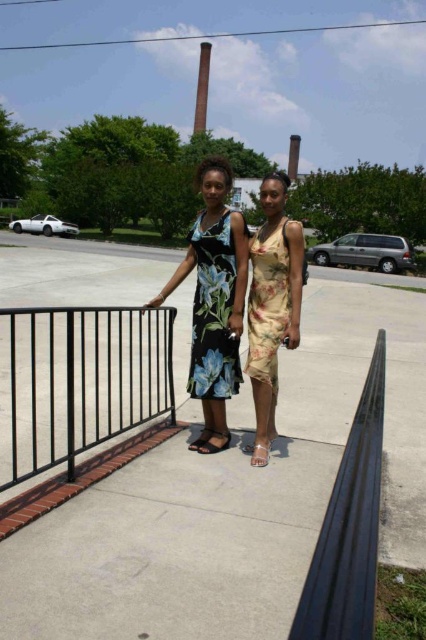
Question: Can you confirm if concrete sidewalk at center is positioned to the left of yellow floral dress at center?

Choices:
 (A) no
 (B) yes

Answer: (B)

Question: Estimate the real-world distances between objects in this image. Which object is closer to the yellow floral dress at center?

Choices:
 (A) matte beige sandal at lower center
 (B) concrete sidewalk at center

Answer: (A)

Question: Which point is closer to the camera?

Choices:
 (A) (155, 301)
 (B) (259, 284)
 (C) (0, 465)
 (D) (195, 440)

Answer: (C)

Question: Is concrete sidewalk at center in front of floral dress at center?

Choices:
 (A) yes
 (B) no

Answer: (A)

Question: Which object is the closest to the matte black sandal at center?

Choices:
 (A) floral silk dress at center
 (B) concrete sidewalk at center
 (C) black metal railing at left

Answer: (A)

Question: Is yellow floral dress at center to the right of matte beige sandal at lower center from the viewer's perspective?

Choices:
 (A) yes
 (B) no

Answer: (A)